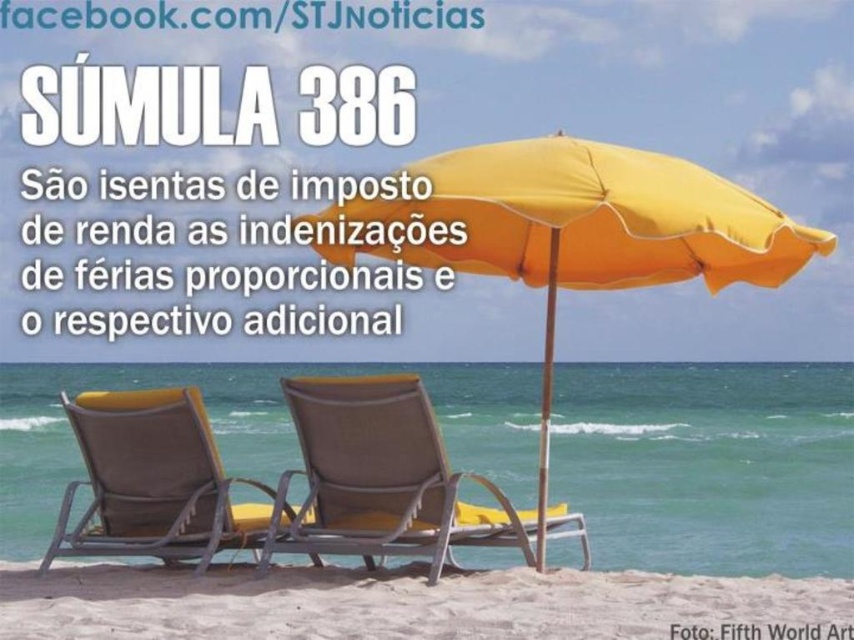
Question: Which of the following is the closest to the observer?

Choices:
 (A) white sandy beach at lower center
 (B) textured fabric beach chair at center

Answer: (A)

Question: Is white sandy beach at lower center smaller than textured fabric lounge chair at center?

Choices:
 (A) no
 (B) yes

Answer: (B)

Question: Considering the real-world distances, which object is closest to the yellow fabric umbrella at center?

Choices:
 (A) textured fabric beach chair at center
 (B) white sandy beach at lower center

Answer: (B)

Question: Which of these objects is positioned farthest from the textured fabric beach chair at center?

Choices:
 (A) white sandy beach at lower center
 (B) textured fabric lounge chair at center

Answer: (A)

Question: Considering the relative positions of textured fabric lounge chair at center and textured fabric beach chair at center in the image provided, where is textured fabric lounge chair at center located with respect to textured fabric beach chair at center?

Choices:
 (A) above
 (B) below

Answer: (B)

Question: Is yellow fabric umbrella at center to the left of textured fabric beach chair at center from the viewer's perspective?

Choices:
 (A) yes
 (B) no

Answer: (B)